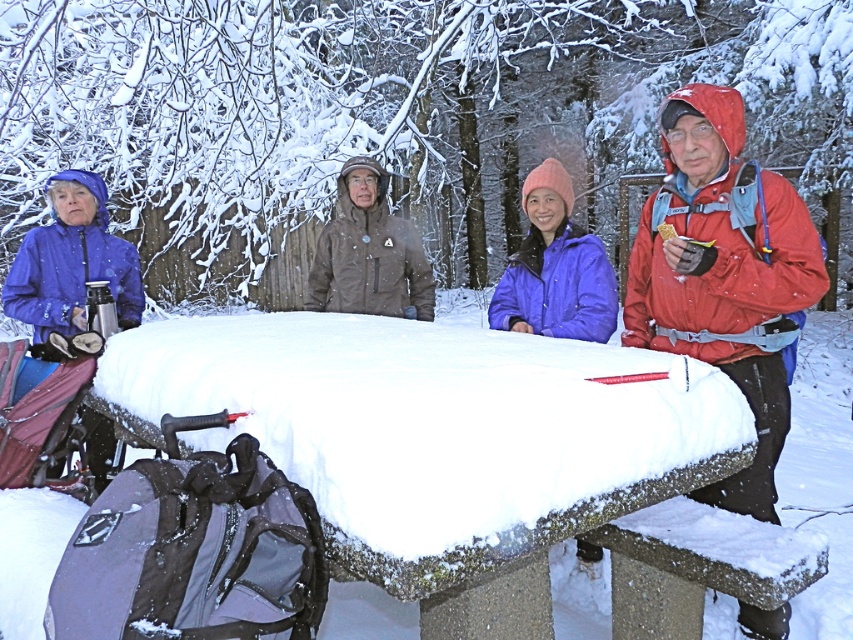
Looking at this image, you are standing at the origin of the coordinate system in the image. You want to move towards the point at coordinates point [555,268]. What object will you encounter first?

The point [555,268] corresponds to the matte blue jacket at center, so you will encounter the matte blue jacket at center first.

You are planning to place a 3.5 feet long rectangular box between the matte blue jacket at center and the brown softshell jacket at center. Can the box fit between them without overlapping either jacket?

The distance between the matte blue jacket at center and the brown softshell jacket at center is 3.67 feet. Since the box is 3.5 feet long, it can fit between them as there is enough space.